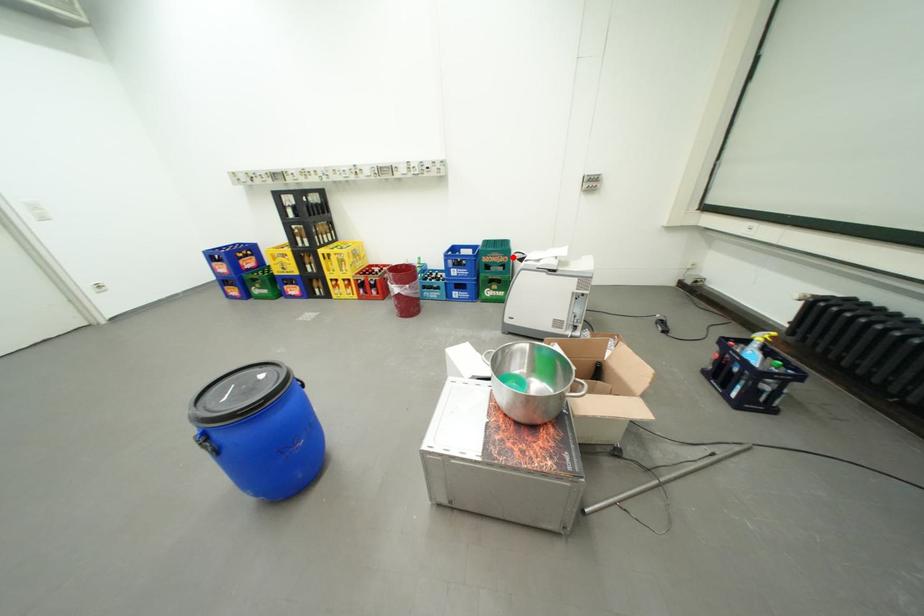
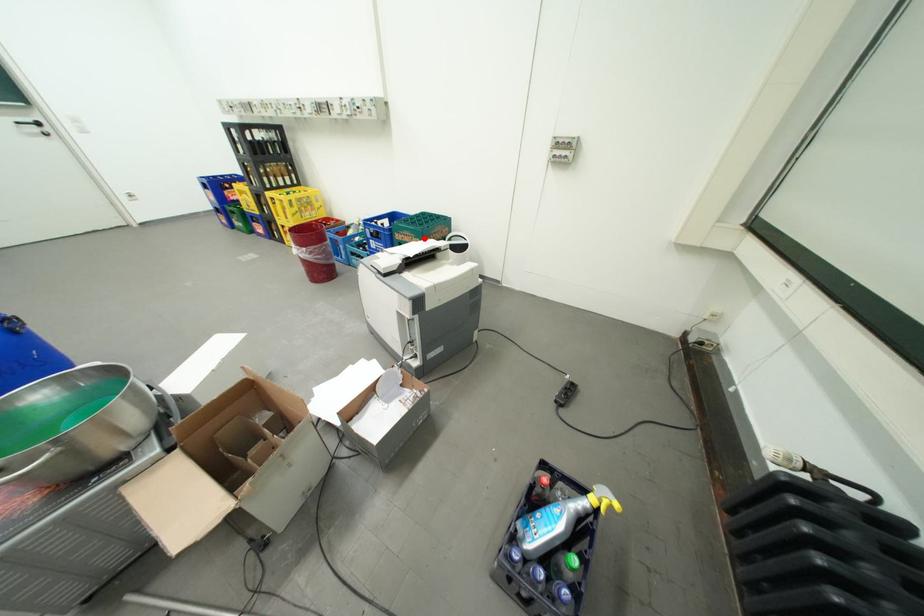
I am providing you with two images of the same scene from different viewpoints. A red point is marked on the first image and another point is marked on the second image. Is the marked point in image1 the same physical position as the marked point in image2?

Yes